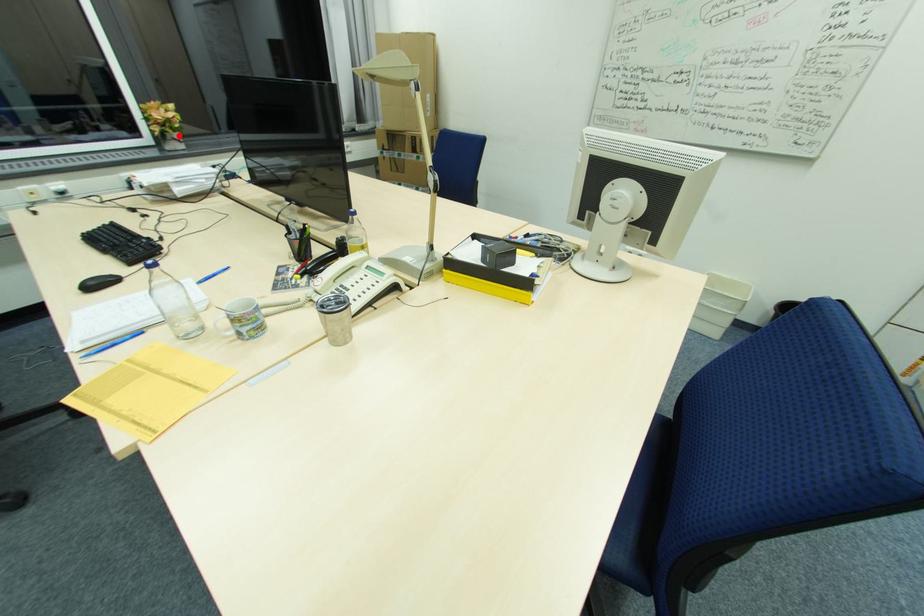
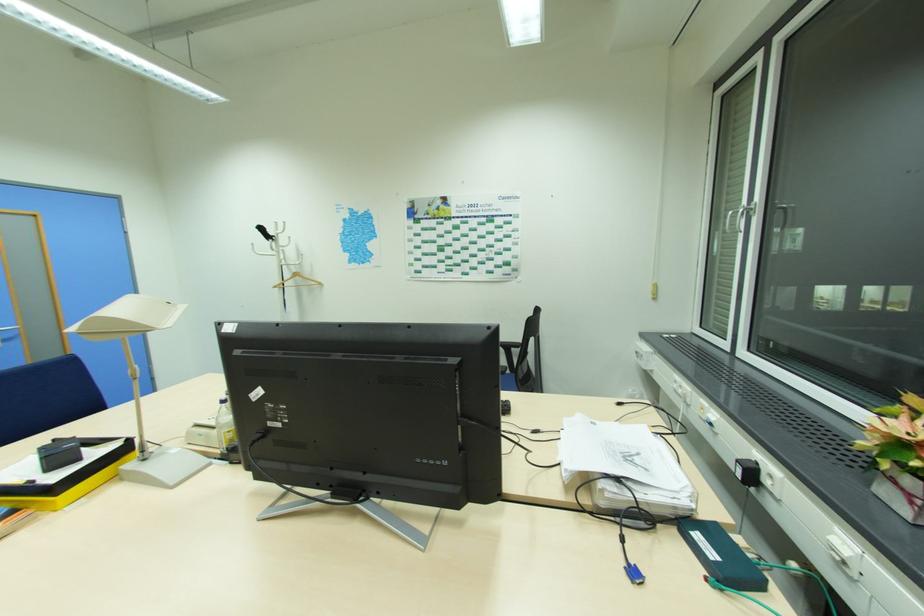
The point at the highlighted location is marked in the first image. Where is the corresponding point in the second image?

(912, 484)